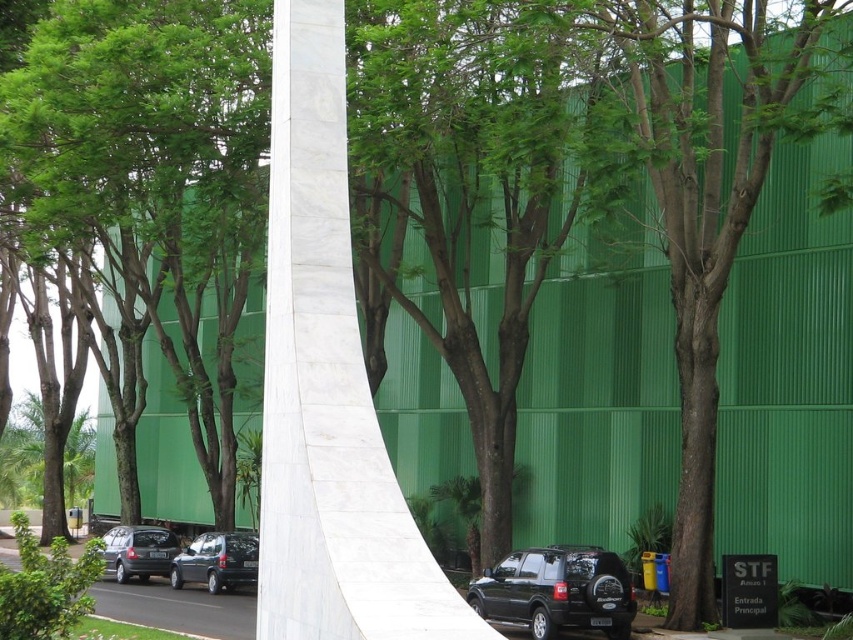
You are a delivery driver needing to park your 2.5 meter long van between the matte black car at center and the matte black suv at center. Can you fit your van there?

The distance between the matte black car at center and the matte black suv at center is 3.55 meters. Since your van is 2.5 meters long, there is enough space to park it between them.